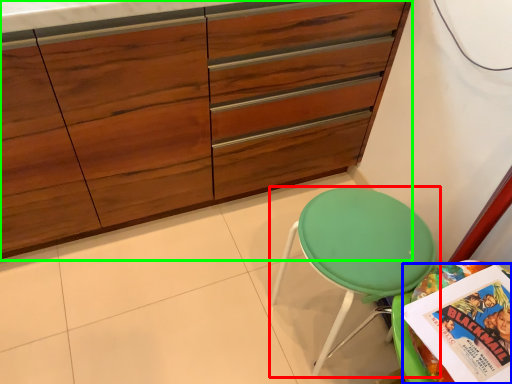
Question: Based on their relative distances, which object is nearer to chair (highlighted by a red box)? Choose from comic book (highlighted by a blue box) and cabinetry (highlighted by a green box).

Choices:
 (A) comic book
 (B) cabinetry

Answer: (A)